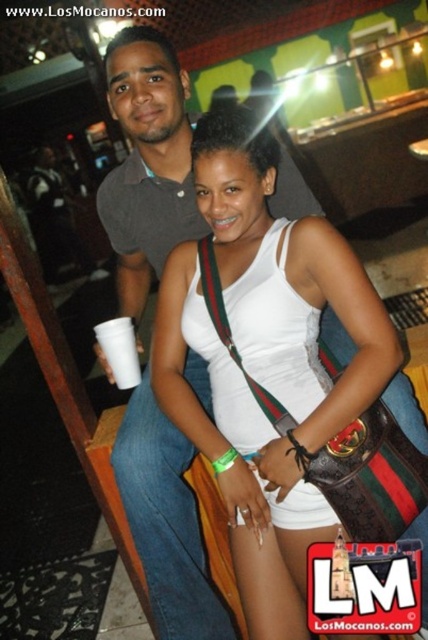
Does white matte tank top at center have a smaller size compared to gray cotton shirt at upper left?

No, white matte tank top at center is not smaller than gray cotton shirt at upper left.

Measure the distance from white matte tank top at center to gray cotton shirt at upper left.

A distance of 15.65 inches exists between white matte tank top at center and gray cotton shirt at upper left.

Which is behind, point (293, 630) or point (189, 492)?

The point (189, 492) is behind.

Identify the location of white matte tank top at center. (267, 364).

Is gray cotton shirt at upper left smaller than white paper cup at lower left?

No, gray cotton shirt at upper left is not smaller than white paper cup at lower left.

Does gray cotton shirt at upper left have a lesser width compared to white paper cup at lower left?

No, gray cotton shirt at upper left is not thinner than white paper cup at lower left.

Which is in front, point (166, 81) or point (131, 340)?

Point (166, 81) is more forward.

You are a GUI agent. You are given a task and a screenshot of the screen. Output one action in this format:
    pyautogui.click(x=<x>, y=<y>)
    Task: Click on the gray cotton shirt at upper left
    Image resolution: width=428 pixels, height=640 pixels.
    Given the screenshot: What is the action you would take?
    pyautogui.click(x=148, y=163)

Between point (184, 253) and point (130, 333), which one is positioned behind?

Positioned behind is point (130, 333).

Can you confirm if white matte tank top at center is positioned above white paper cup at lower left?

No.

This screenshot has width=428, height=640. I want to click on white matte tank top at center, so click(267, 364).